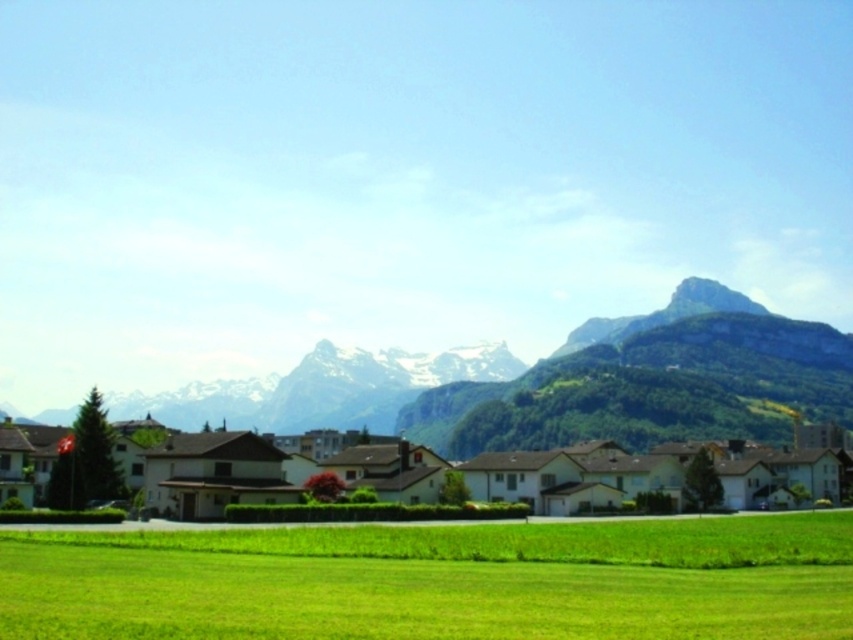
Does green grass at center have a lesser height compared to green grassy hillside at lower center?

Indeed, green grass at center has a lesser height compared to green grassy hillside at lower center.

Does green grass at center appear over green grassy hillside at lower center?

Yes, green grass at center is above green grassy hillside at lower center.

Where is `green grass at center`? Image resolution: width=853 pixels, height=640 pixels. green grass at center is located at coordinates (437, 580).